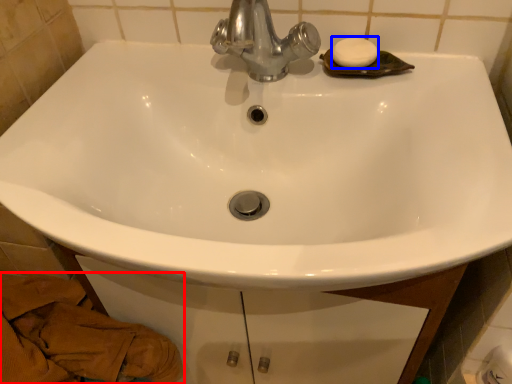
Question: Which object appears farthest to the camera in this image, material (highlighted by a red box) or soap (highlighted by a blue box)?

Choices:
 (A) material
 (B) soap

Answer: (B)